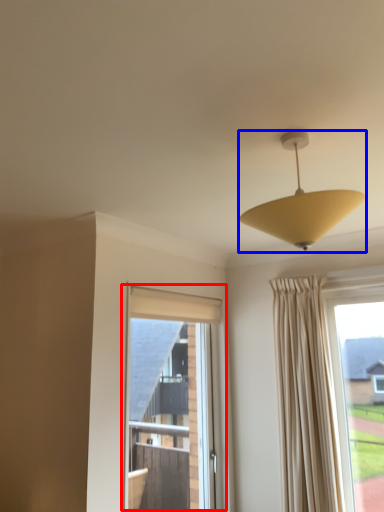
Question: Which object is closer to the camera taking this photo, window (highlighted by a red box) or lamp (highlighted by a blue box)?

Choices:
 (A) window
 (B) lamp

Answer: (B)